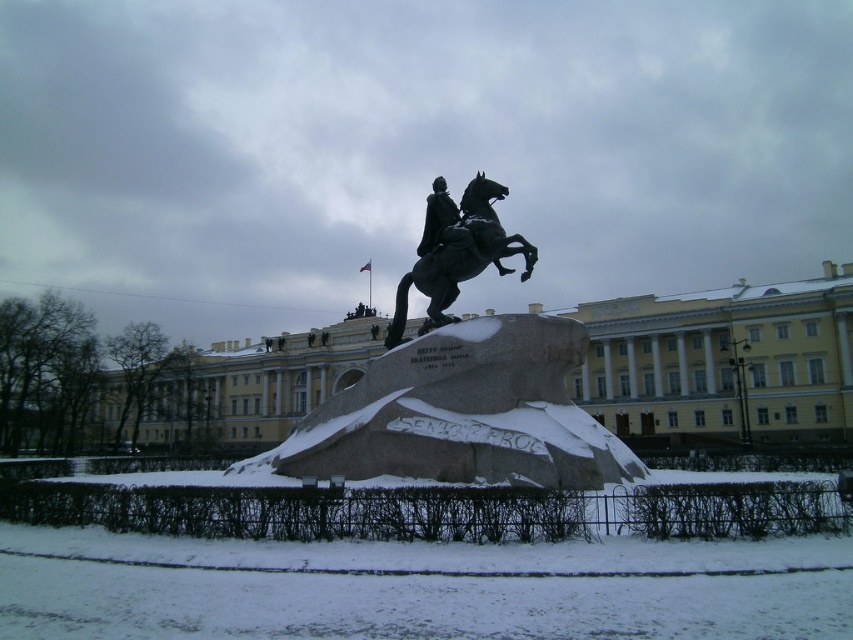
You are standing at the point with coordinates (460, 392) in the winter scene. What object are you standing on?

The point with coordinates (460, 392) is on the bronze statue at center.

You are an art student analyzing the winter scene. You notice the black polished stone horse at center and the black polished statue at center. Which object is wider?

The black polished stone horse at center is wider than the black polished statue at center as stated in the description.

You are standing in front of the classical building and see the black polished stone horse at center and the black polished statue at center. Which object is positioned to the right of the other?

The black polished stone horse at center is to the right of the black polished statue at center.